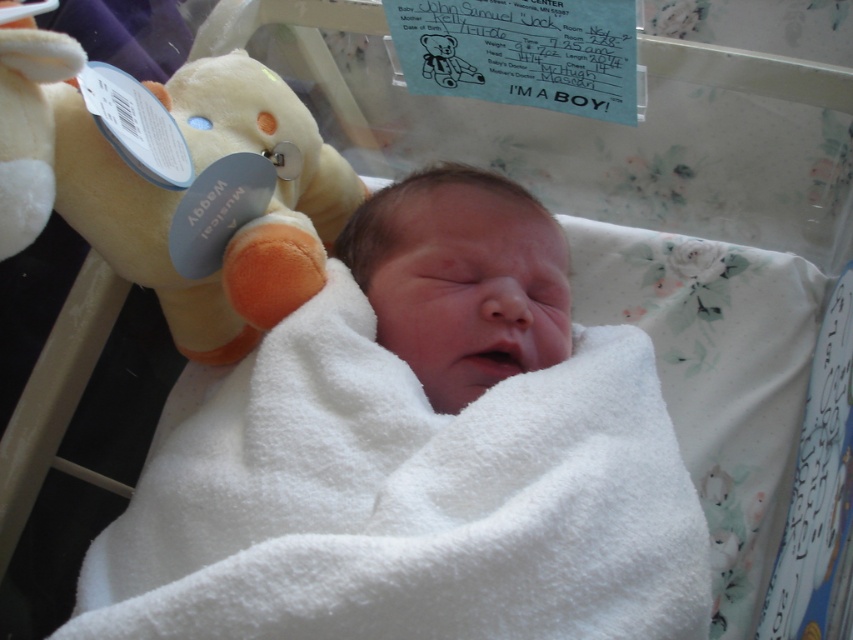
Between point (64, 188) and point (514, 308), which one is positioned in front?

Positioned in front is point (514, 308).

Which is more to the right, soft plush bear at upper left or smooth white newborn at center?

smooth white newborn at center

Find the location of `soft plush bear at upper left`. soft plush bear at upper left is located at coordinates (180, 196).